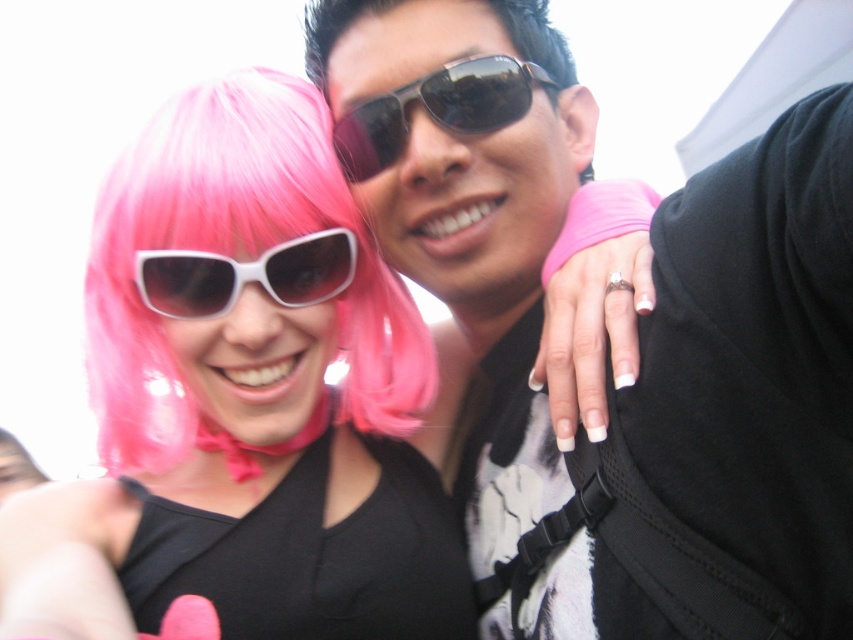
Is black matte dress at center thinner than white matte sunglasses at center?

Incorrect, black matte dress at center's width is not less than white matte sunglasses at center's.

Does black matte dress at center have a larger size compared to white matte sunglasses at center?

Yes.

Who is more forward, [476,616] or [155,292]?

Point [155,292] is more forward.

You are a GUI agent. You are given a task and a screenshot of the screen. Output one action in this format:
    pyautogui.click(x=<x>, y=<y>)
    Task: Click on the black matte dress at center
    Image resolution: width=853 pixels, height=640 pixels.
    Given the screenshot: What is the action you would take?
    pyautogui.click(x=312, y=557)

Between black matte dress at center and sunglasses at center, which one has more height?

With more height is black matte dress at center.

Can you confirm if black matte dress at center is positioned above sunglasses at center?

Actually, black matte dress at center is below sunglasses at center.

Between point (357, 512) and point (502, 72), which one is positioned in front?

Positioned in front is point (502, 72).

Locate an element on the screen. black matte dress at center is located at coordinates (312, 557).

Looking at this image, is matte black sunglasses at upper center bigger than white matte sunglasses at center?

Correct, matte black sunglasses at upper center is larger in size than white matte sunglasses at center.

Which is in front, point (699, 349) or point (344, 276)?

Point (699, 349)

Between point (714, 321) and point (329, 278), which one is positioned in front?

Point (714, 321) is more forward.

At what (x,y) coordinates should I click in order to perform the action: click on matte black sunglasses at upper center. Please return your answer as a coordinate pair (x, y). Looking at the image, I should click on (639, 330).